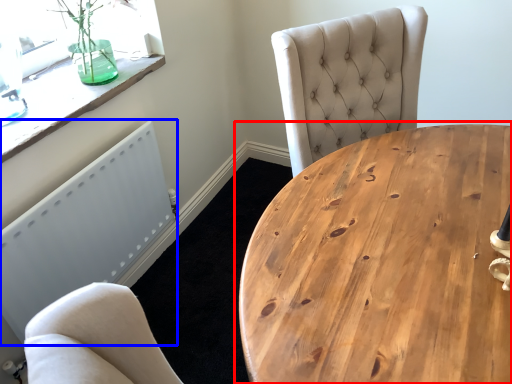
Question: Which object appears closest to the camera in this image, coffee table (highlighted by a red box) or radiator (highlighted by a blue box)?

Choices:
 (A) coffee table
 (B) radiator

Answer: (A)